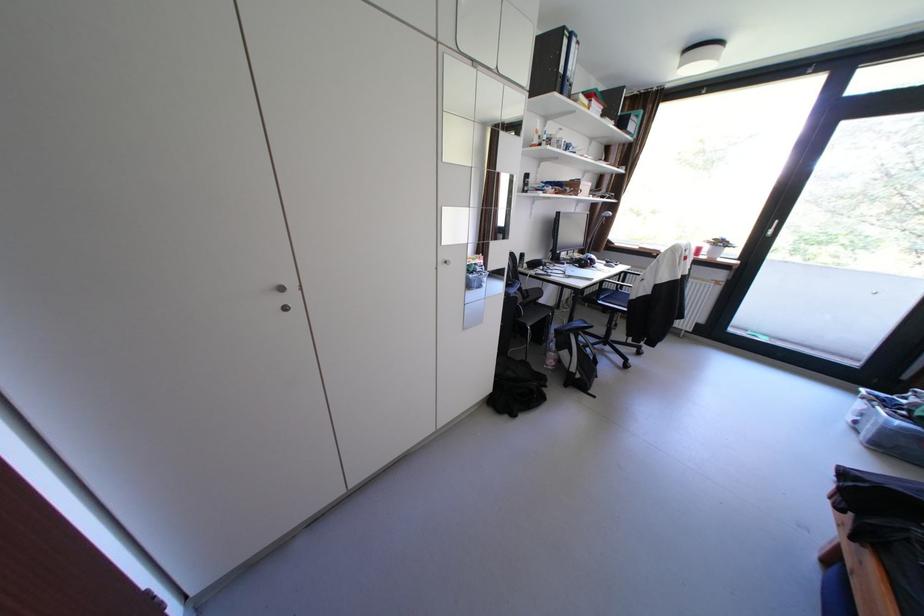
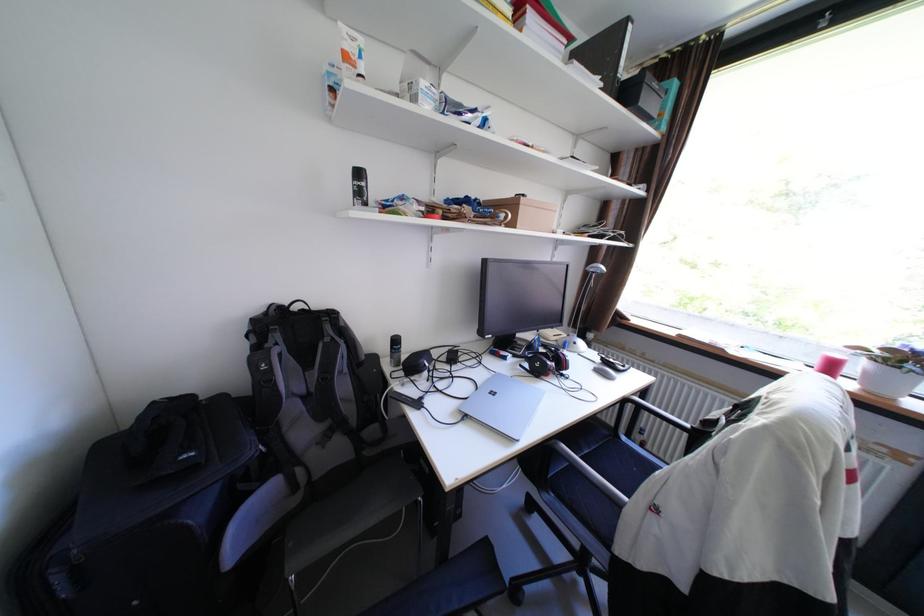
The images are taken continuously from a first-person perspective. In which direction are you moving?

The cameraman moved toward right, forward.